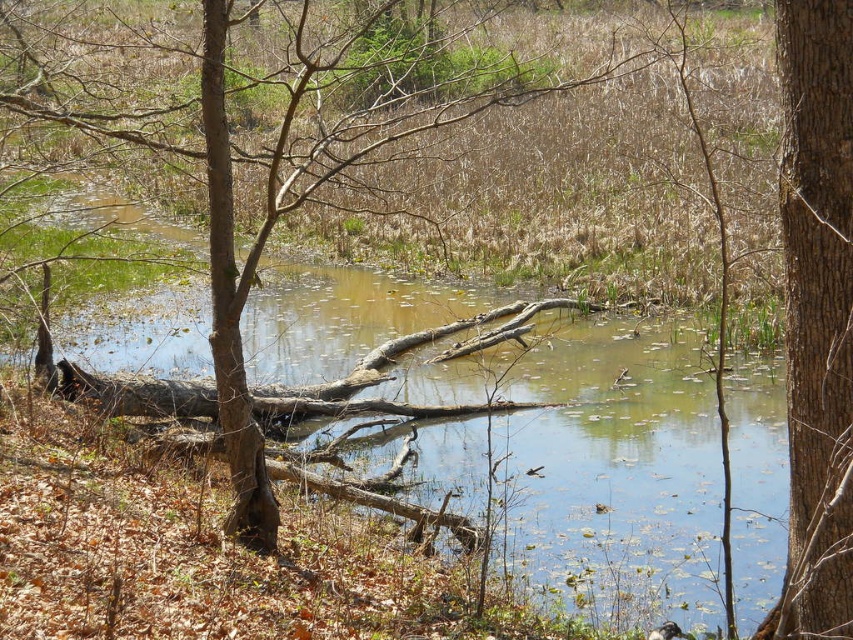
Question: Is brown wood log at center thinner than brown rough bark tree at right?

Choices:
 (A) yes
 (B) no

Answer: (B)

Question: Which point appears closest to the camera in this image?

Choices:
 (A) (662, 582)
 (B) (798, 513)

Answer: (B)

Question: Which of these objects is positioned farthest from the brown rough bark tree trunk at left?

Choices:
 (A) brown wood log at center
 (B) brown rough bark tree at right

Answer: (A)

Question: Can you confirm if brown wood log at center is bigger than brown rough bark tree trunk at left?

Choices:
 (A) no
 (B) yes

Answer: (B)

Question: Can you confirm if brown wood log at center is positioned to the left of brown rough bark tree at right?

Choices:
 (A) yes
 (B) no

Answer: (A)

Question: Which object is closer to the camera taking this photo?

Choices:
 (A) brown wood log at center
 (B) brown rough bark tree at right
 (C) brown rough bark tree trunk at left

Answer: (B)